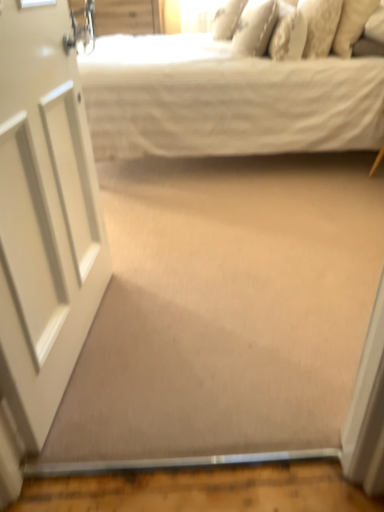
Question: Is floral-patterned fabric pillow at upper right, arranged as the 4th pillow when viewed from the left, to the left or to the right of white cotton bed at upper center in the image?

Choices:
 (A) left
 (B) right

Answer: (B)

Question: Looking at the image, does floral-patterned fabric pillow at upper right, arranged as the 4th pillow when viewed from the left, seem bigger or smaller compared to white cotton bed at upper center?

Choices:
 (A) small
 (B) big

Answer: (A)

Question: Which object is the closest to the white textured pillow at upper center, the 3th pillow positioned from the left?

Choices:
 (A) white textured pillow at upper center, positioned as the 2th pillow in left-to-right order
 (B) white textured pillow at upper right, acting as the fifth pillow starting from the left
 (C) floral-patterned fabric pillow at upper right, the second pillow positioned from the right
 (D) white textured pillow at upper center, placed as the fifth pillow when sorted from right to left
 (E) white cotton bed at upper center

Answer: (C)

Question: Estimate the real-world distances between objects in this image. Which object is closer to the white textured pillow at upper right, which appears as the 1th pillow when viewed from the right?

Choices:
 (A) white textured pillow at upper center, positioned as the 2th pillow in left-to-right order
 (B) white textured pillow at upper center, arranged as the 1th pillow when viewed from the left
 (C) white cotton bed at upper center
 (D) white textured pillow at upper center, the 3th pillow positioned from the left
 (E) white glossy door at left

Answer: (D)